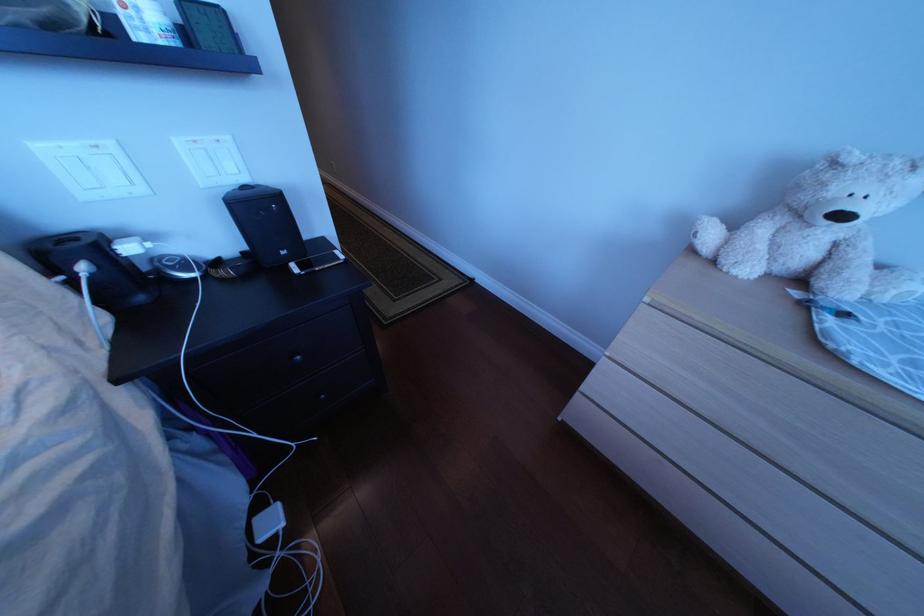
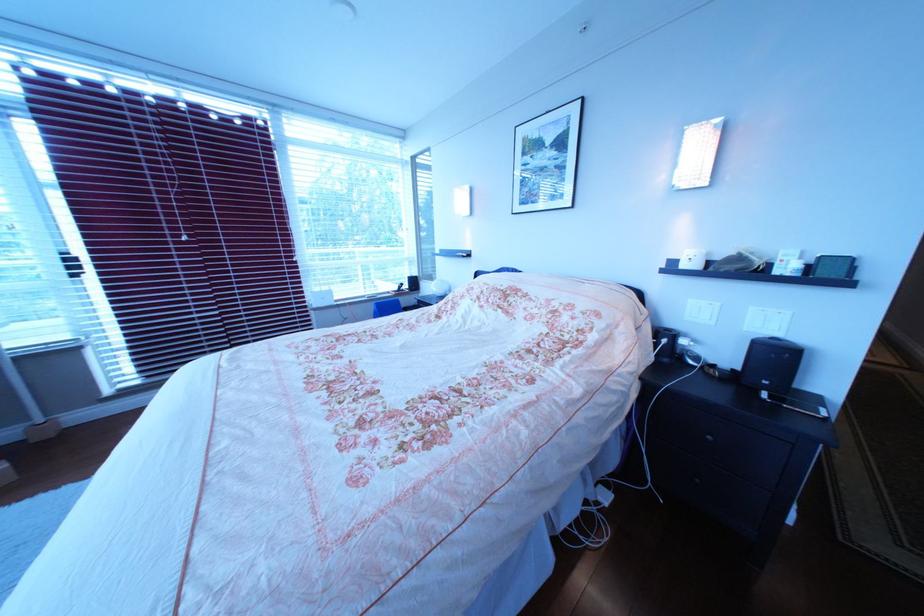
Where in the second image is the point corresponding to the point at 317,272 from the first image?

(785, 400)